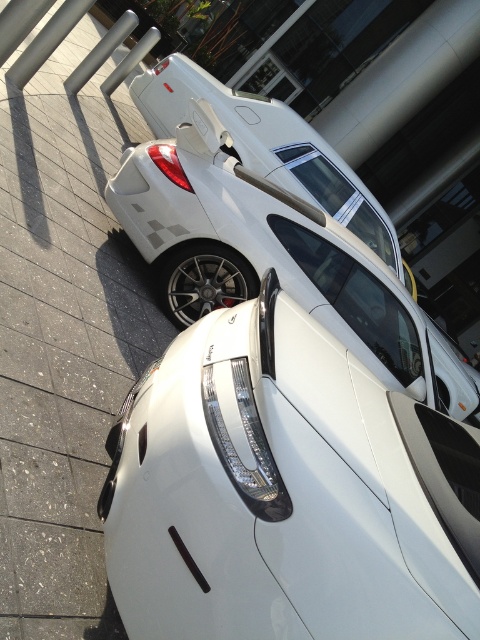
Does white glossy car at center have a lesser height compared to white glossy car at upper center?

Yes.

Looking at this image, which of these two, white glossy car at center or white glossy car at upper center, stands taller?

white glossy car at upper center is taller.

Locate an element on the screen. white glossy car at center is located at coordinates (287, 492).